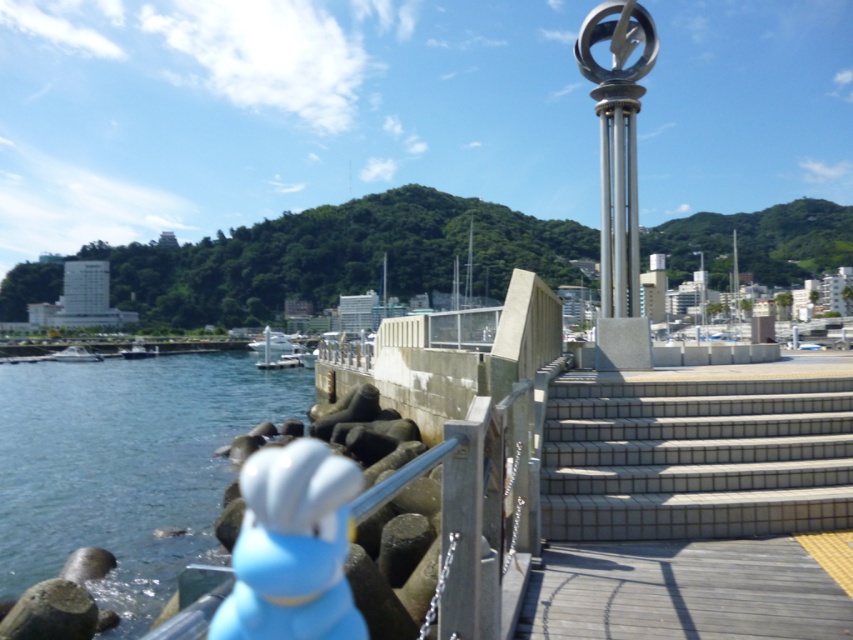
Question: Estimate the real-world distances between objects in this image. Which object is closer to the white tile stairs at center?

Choices:
 (A) white glossy boat at left
 (B) polished silver pole at center-right
 (C) dark blue metallic boat at lower left

Answer: (B)

Question: Is blue water at lower left wider than white glossy boat at left?

Choices:
 (A) yes
 (B) no

Answer: (A)

Question: Is white glossy boat at left above dark blue metallic boat at lower left?

Choices:
 (A) no
 (B) yes

Answer: (B)

Question: Is blue water at lower left to the left of white glossy boat at left from the viewer's perspective?

Choices:
 (A) yes
 (B) no

Answer: (B)

Question: Which point is closer to the camera?

Choices:
 (A) polished silver pole at center-right
 (B) dark blue metallic boat at lower left

Answer: (A)

Question: Which object is farther from the camera taking this photo?

Choices:
 (A) white tile stairs at center
 (B) blue water at lower left
 (C) dark blue metallic boat at lower left
 (D) white glossy boat at left

Answer: (C)